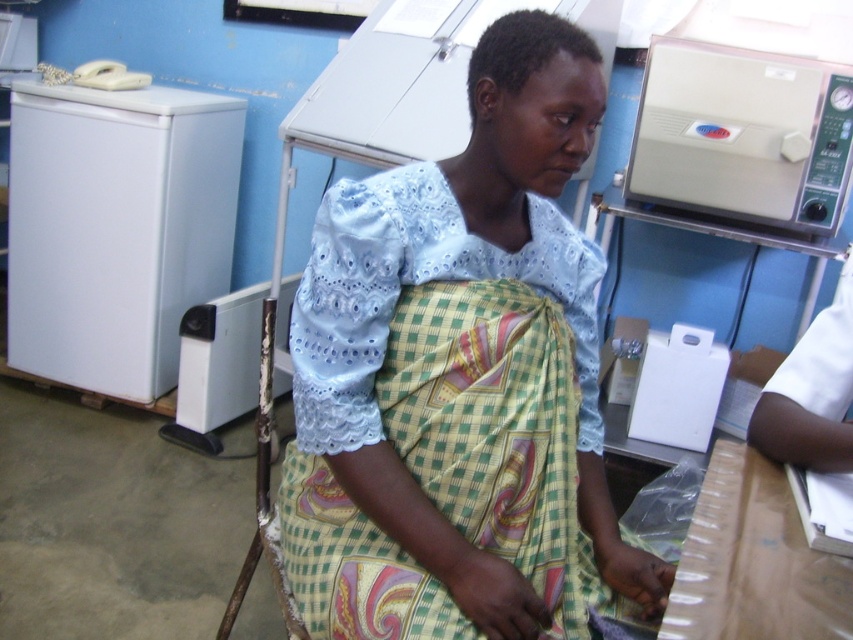
Which is more to the right, light blue lace blouse at center or beige plastic sterilizer at upper right?

beige plastic sterilizer at upper right is more to the right.

Can you confirm if light blue lace blouse at center is wider than beige plastic sterilizer at upper right?

Indeed, light blue lace blouse at center has a greater width compared to beige plastic sterilizer at upper right.

Is point (294, 486) in front of point (788, 179)?

Yes, point (294, 486) is closer to viewer.

Image resolution: width=853 pixels, height=640 pixels. I want to click on light blue lace blouse at center, so click(x=459, y=376).

The image size is (853, 640). Describe the element at coordinates (115, 228) in the screenshot. I see `white matte refrigerator at left` at that location.

Which is below, white matte refrigerator at left or beige plastic sterilizer at upper right?

white matte refrigerator at left is lower down.

Describe the element at coordinates (115, 228) in the screenshot. I see `white matte refrigerator at left` at that location.

Locate an element on the screen. The width and height of the screenshot is (853, 640). white matte refrigerator at left is located at coordinates (115, 228).

Is light blue lace blouse at center below white matte refrigerator at left?

Correct, light blue lace blouse at center is located below white matte refrigerator at left.

Does light blue lace blouse at center appear on the right side of white matte refrigerator at left?

Indeed, light blue lace blouse at center is positioned on the right side of white matte refrigerator at left.

This screenshot has width=853, height=640. Describe the element at coordinates (459, 376) in the screenshot. I see `light blue lace blouse at center` at that location.

This screenshot has width=853, height=640. What are the coordinates of `light blue lace blouse at center` in the screenshot? It's located at [x=459, y=376].